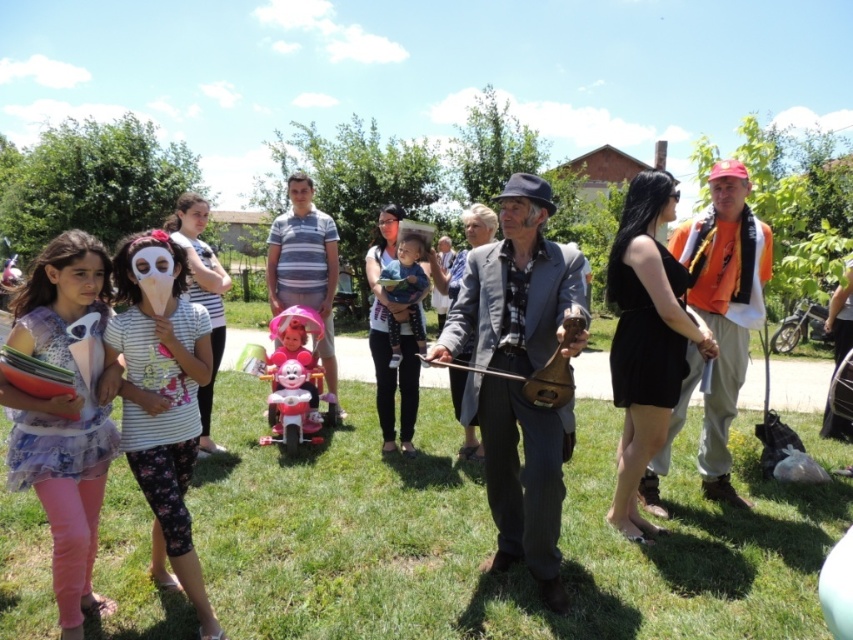
In the scene shown: You are a photographer trying to capture a clear photo of the matte gray suit at center and the light blue fabric baby at center. Which object is positioned closer to the front of the scene?

The matte gray suit at center is closer to the viewer than the light blue fabric baby at center, so the matte gray suit at center is positioned closer to the front of the scene.

You are a photographer standing at the camera position. You want to take a closeup photo of the matte gray suit at center. The camera can focus on objects within 2 meters. Can you take the photo without moving closer?

The matte gray suit at center is 2.90 meters away from the camera. Since the camera can only focus on objects within 2 meters, you cannot take the closeup photo without moving closer.

You are a photographer at the event and want to capture a photo that includes both the matte gray suit at center and the light blue fabric baby at center. Based on their positions, which object should you focus on first to ensure both are in frame?

The matte gray suit at center is located below the light blue fabric baby at center, so you should focus on the light blue fabric baby at center first to ensure both are in frame.